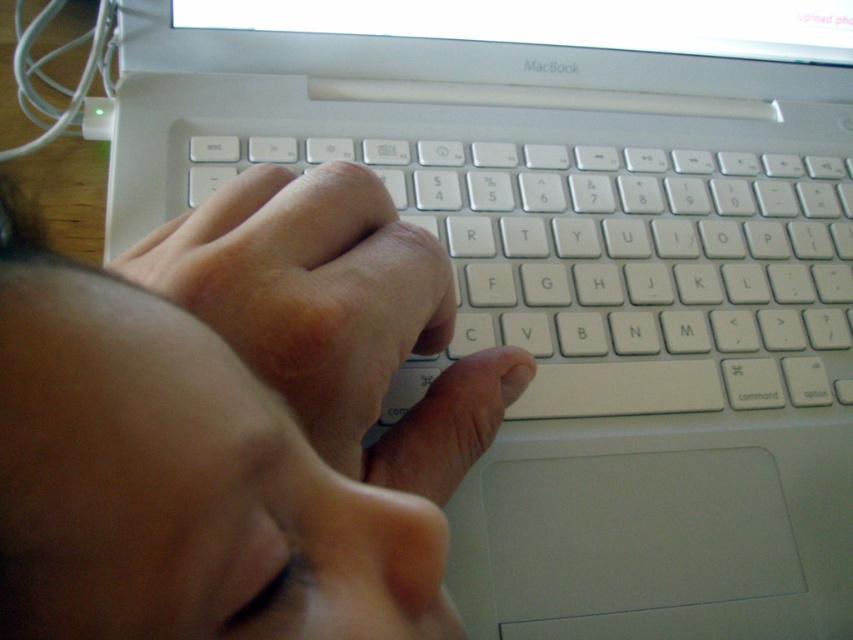
Question: Does matte white hand at center have a greater width compared to white plastic keyboard at center?

Choices:
 (A) no
 (B) yes

Answer: (A)

Question: Can you confirm if matte white hand at center is bigger than white plastic keyboard at center?

Choices:
 (A) no
 (B) yes

Answer: (A)

Question: Which point is closer to the camera?

Choices:
 (A) matte white hand at center
 (B) white plastic keyboard at center

Answer: (A)

Question: Can you confirm if matte white hand at center is positioned below white plastic keyboard at center?

Choices:
 (A) yes
 (B) no

Answer: (A)

Question: Which point is farther to the camera?

Choices:
 (A) white plastic keyboard at center
 (B) matte white hand at center

Answer: (A)